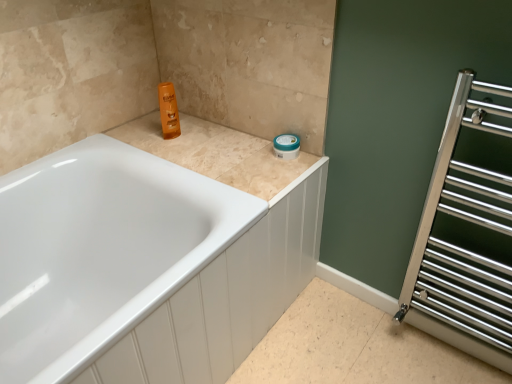
Question: Is polished chrome towel rack at right bigger than beige tile counter top at upper center?

Choices:
 (A) yes
 (B) no

Answer: (A)

Question: Is polished chrome towel rack at right facing away from beige tile counter top at upper center?

Choices:
 (A) yes
 (B) no

Answer: (B)

Question: Is polished chrome towel rack at right wider than beige tile counter top at upper center?

Choices:
 (A) yes
 (B) no

Answer: (B)

Question: Is polished chrome towel rack at right to the right of beige tile counter top at upper center from the viewer's perspective?

Choices:
 (A) no
 (B) yes

Answer: (B)

Question: Can you confirm if polished chrome towel rack at right is thinner than beige tile counter top at upper center?

Choices:
 (A) yes
 (B) no

Answer: (A)

Question: Considering the positions of point (28, 291) and point (135, 125), is point (28, 291) closer or farther from the camera than point (135, 125)?

Choices:
 (A) closer
 (B) farther

Answer: (A)

Question: From a real-world perspective, relative to beige tile counter top at upper center, is white glossy bathtub at upper left vertically above or below?

Choices:
 (A) above
 (B) below

Answer: (B)

Question: Is white glossy bathtub at upper left bigger or smaller than beige tile counter top at upper center?

Choices:
 (A) big
 (B) small

Answer: (A)

Question: Is white glossy bathtub at upper left inside or outside of beige tile counter top at upper center?

Choices:
 (A) inside
 (B) outside

Answer: (B)

Question: Considering the positions of point (252, 187) and point (19, 190), is point (252, 187) closer or farther from the camera than point (19, 190)?

Choices:
 (A) closer
 (B) farther

Answer: (A)

Question: Relative to white glossy bathtub at upper left, is beige tile counter top at upper center in front or behind?

Choices:
 (A) front
 (B) behind

Answer: (B)

Question: Considering the positions of beige tile counter top at upper center and white glossy bathtub at upper left in the image, is beige tile counter top at upper center bigger or smaller than white glossy bathtub at upper left?

Choices:
 (A) small
 (B) big

Answer: (A)

Question: From a real-world perspective, relative to white glossy bathtub at upper left, is beige tile counter top at upper center vertically above or below?

Choices:
 (A) below
 (B) above

Answer: (B)

Question: In the image, is beige tile counter top at upper center positioned in front of or behind polished chrome towel rack at right?

Choices:
 (A) behind
 (B) front

Answer: (A)

Question: Is point (290, 163) positioned closer to the camera than point (502, 249)?

Choices:
 (A) farther
 (B) closer

Answer: (A)